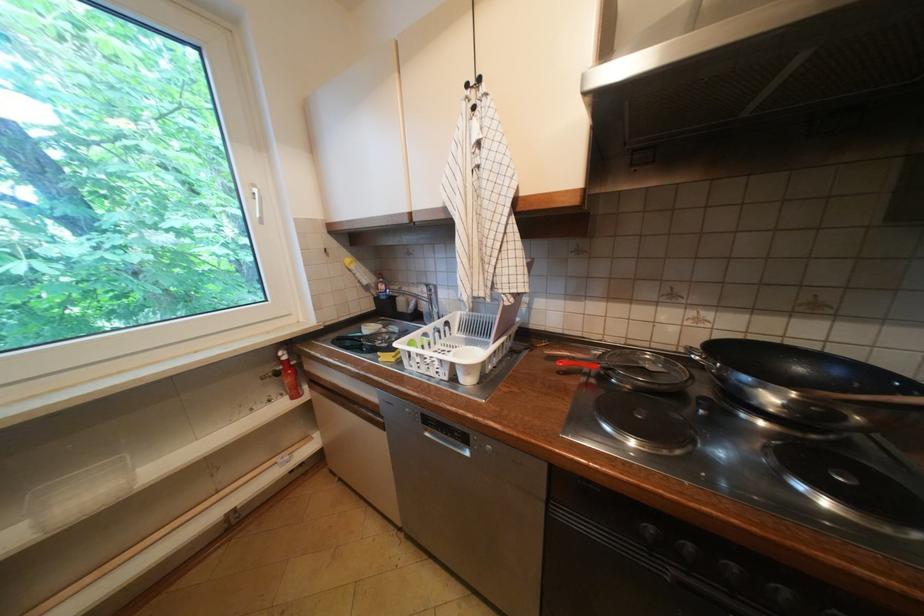
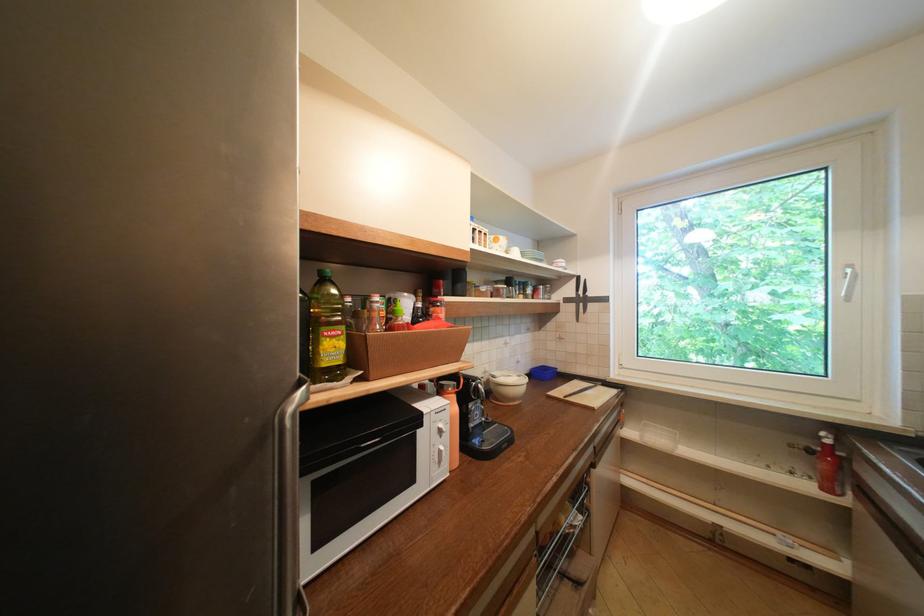
Locate, in the second image, the point that corresponds to point (262, 200) in the first image.

(854, 280)